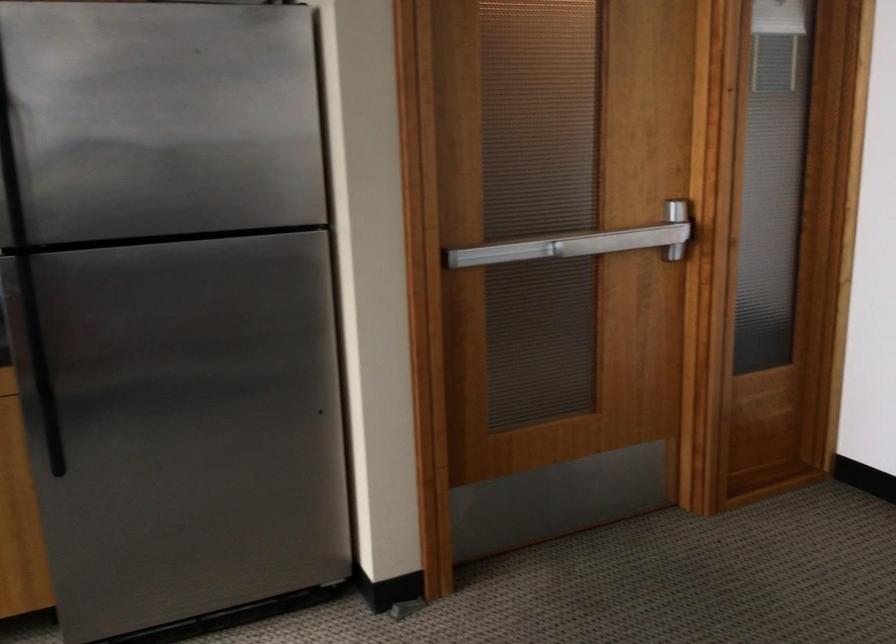
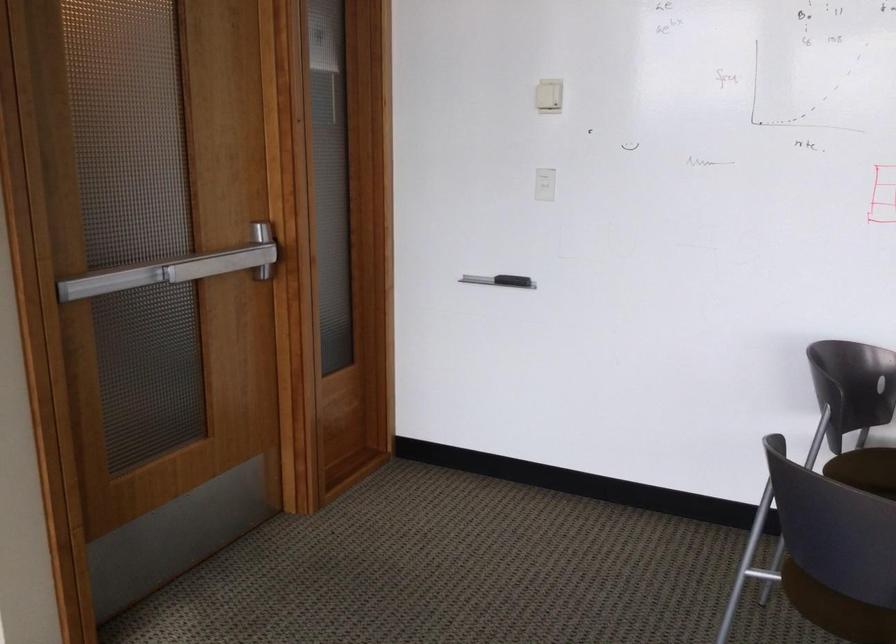
Question: How did the camera likely rotate?

Choices:
 (A) Left
 (B) Right
 (C) Up
 (D) Down

Answer: (B)